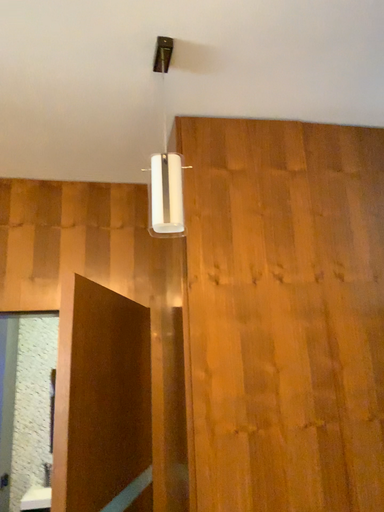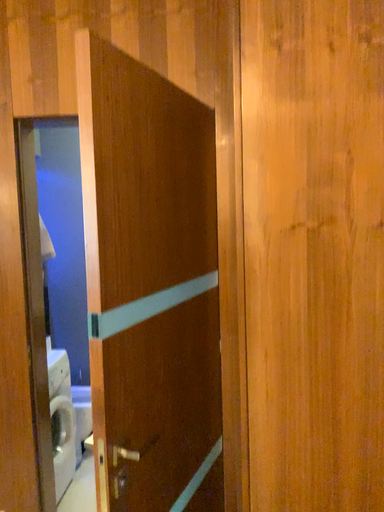
Question: Which way did the camera rotate in the video?

Choices:
 (A) rotated upward
 (B) rotated downward

Answer: (B)